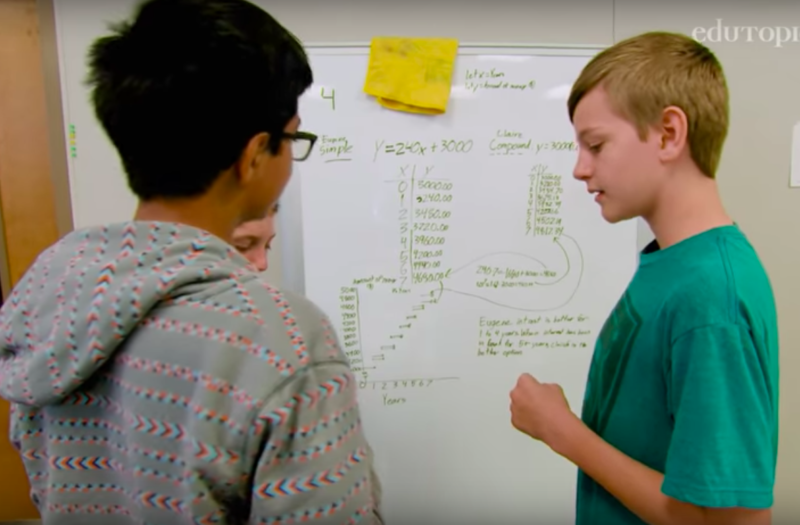
Find the location of a particular element. This screenshot has width=800, height=525. wooden door is located at coordinates (29, 125).